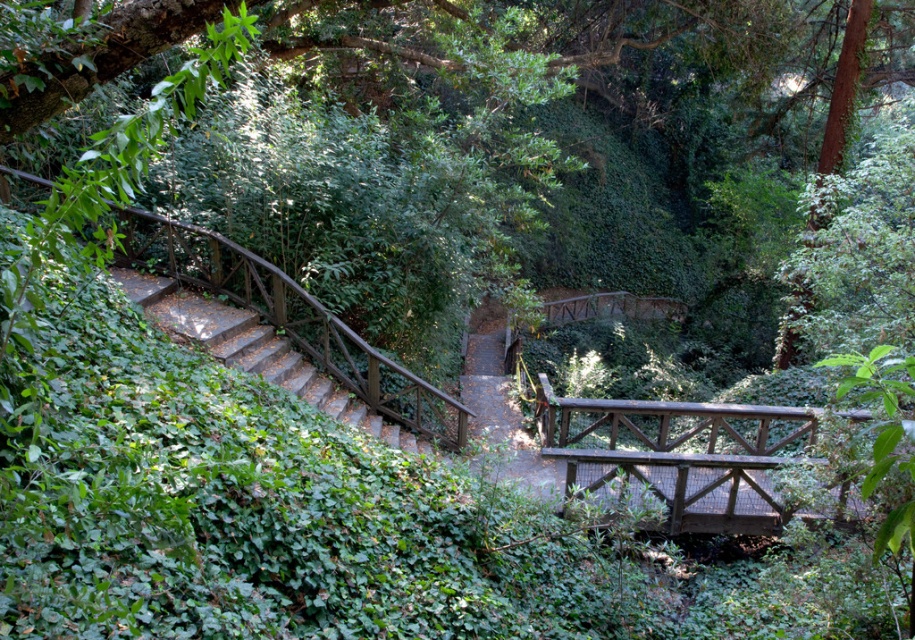
Question: Which point is farther to the camera?

Choices:
 (A) (545, 452)
 (B) (221, 342)

Answer: (A)

Question: Considering the relative positions of wooden bridge at center and wooden stairs at left in the image provided, where is wooden bridge at center located with respect to wooden stairs at left?

Choices:
 (A) above
 (B) below

Answer: (B)

Question: Is wooden bridge at center below wooden stairs at left?

Choices:
 (A) no
 (B) yes

Answer: (B)

Question: Which point appears farthest from the camera in this image?

Choices:
 (A) (650, 508)
 (B) (202, 316)

Answer: (B)

Question: Is wooden bridge at center bigger than wooden stairs at left?

Choices:
 (A) no
 (B) yes

Answer: (A)

Question: Which of the following is the closest to the observer?

Choices:
 (A) wooden bridge at center
 (B) wooden stairs at left

Answer: (A)